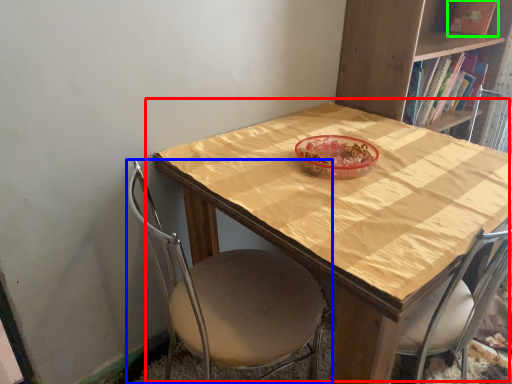
Question: Estimate the real-world distances between objects in this image. Which object is closer to table (highlighted by a red box), chair (highlighted by a blue box) or book (highlighted by a green box)?

Choices:
 (A) chair
 (B) book

Answer: (A)